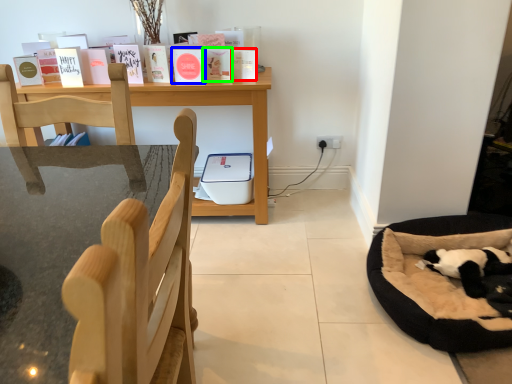
Question: Based on their relative distances, which object is farther from paperback book (highlighted by a red box)? Choose from paperback book (highlighted by a blue box) and paperback book (highlighted by a green box).

Choices:
 (A) paperback book
 (B) paperback book

Answer: (A)